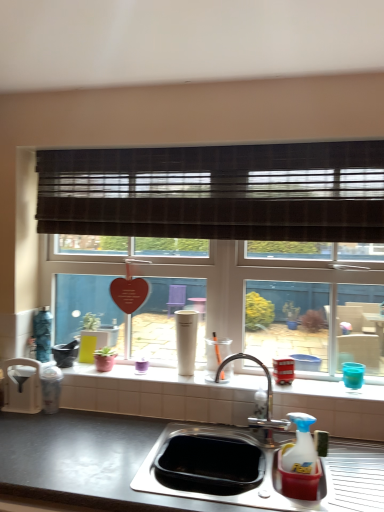
Question: Considering the relative positions of stainless steel sink at lower center and metallic red bus at right, the 2th appliance in the right-to-left sequence, in the image provided, is stainless steel sink at lower center to the left or to the right of metallic red bus at right, the 2th appliance in the right-to-left sequence,?

Choices:
 (A) left
 (B) right

Answer: (A)

Question: Is point (89, 498) closer or farther from the camera than point (288, 367)?

Choices:
 (A) closer
 (B) farther

Answer: (A)

Question: Estimate the real-world distances between objects in this image. Which object is closer to the white glossy window sill at center?

Choices:
 (A) metallic red bus at right, positioned as the fourth appliance in left-to-right order
 (B) brown textured blind at upper center
 (C) stainless steel sink at lower center
 (D) white matte cup at center, the third appliance from the left
 (E) blue plastic cup at right, which ranks as the 1th appliance in right-to-left order

Answer: (D)

Question: Which of these objects is positioned farthest from the blue plastic cup at right, positioned as the fifth appliance in left-to-right order?

Choices:
 (A) white matte cup at center, the third appliance viewed from the right
 (B) white plastic trash can at left, arranged as the fifth appliance when viewed from the right
 (C) metallic red bus at right, the 2th appliance in the right-to-left sequence
 (D) chrome metallic faucet at center
 (E) brown textured blind at upper center

Answer: (B)